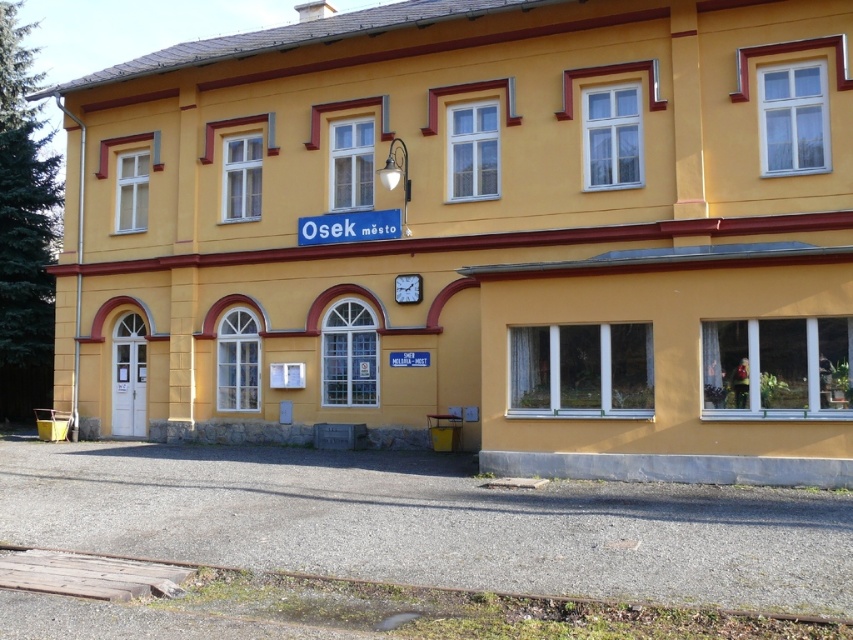
You are standing in front of the two story building. The point at (x=477, y=236) is marked on the building. What is the color of the building at that point?

The point at (x=477, y=236) indicates matte yellow building at center, so the color is matte yellow.

Looking at this image, you are a painter who needs to decide whether to use a ladder or a step stool for a painting job. You see the matte yellow building at center and the white plastic window at center. Which tool should you choose based on their heights?

The matte yellow building at center is taller than the white plastic window at center, so you should use a ladder for the building and a step stool for the window.